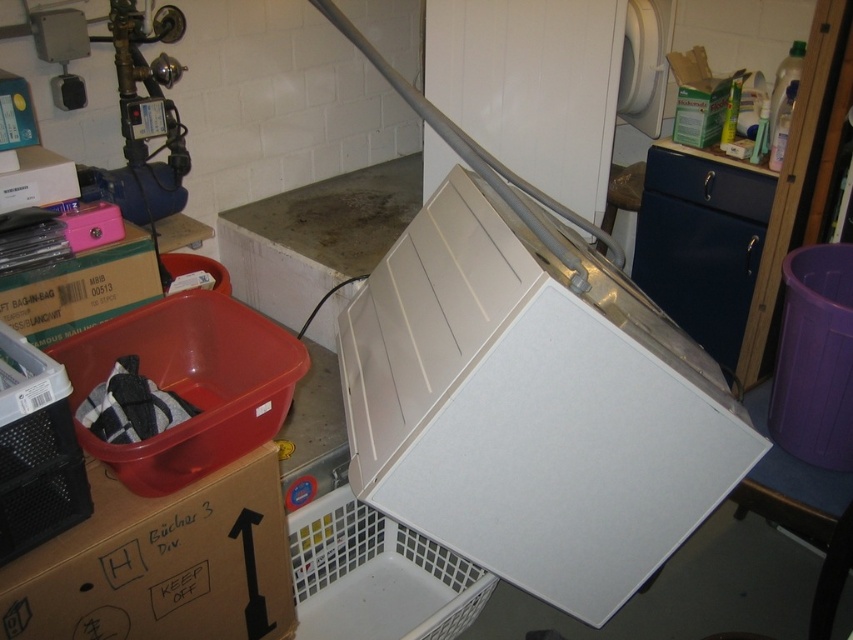
Question: Does cardboard box at lower left appear under white plastic basket at lower center?

Choices:
 (A) yes
 (B) no

Answer: (B)

Question: Estimate the real-world distances between objects in this image. Which object is closer to the matte cardboard box at left?

Choices:
 (A) white plastic basket at lower center
 (B) white cardboard box at upper left

Answer: (B)

Question: Does matte cardboard box at left appear on the right side of white cardboard box at upper left?

Choices:
 (A) yes
 (B) no

Answer: (A)

Question: Which of the following is the farthest from the observer?

Choices:
 (A) cardboard box at lower left
 (B) white plastic basket at lower center
 (C) white cardboard box at upper left
 (D) matte cardboard box at left

Answer: (B)

Question: Which object appears farthest from the camera in this image?

Choices:
 (A) white plastic basket at lower center
 (B) matte cardboard box at left
 (C) cardboard box at lower left

Answer: (A)

Question: Does matte cardboard box at left have a smaller size compared to white cardboard box at upper left?

Choices:
 (A) no
 (B) yes

Answer: (A)